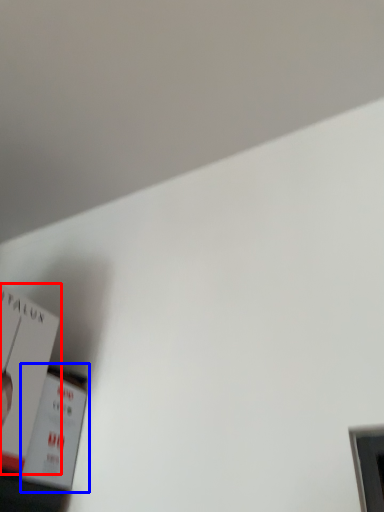
Question: Which object is closer to the camera taking this photo, paperback book (highlighted by a red box) or paperback book (highlighted by a blue box)?

Choices:
 (A) paperback book
 (B) paperback book

Answer: (A)